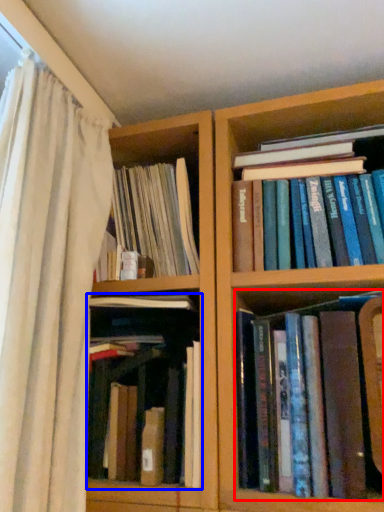
Question: Among these objects, which one is nearest to the camera, book (highlighted by a red box) or book (highlighted by a blue box)?

Choices:
 (A) book
 (B) book

Answer: (A)